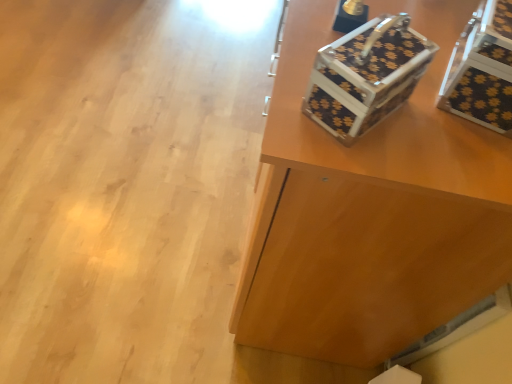
I want to click on free space in front of metallic floral-patterned shoe box at upper right, so click(x=351, y=160).